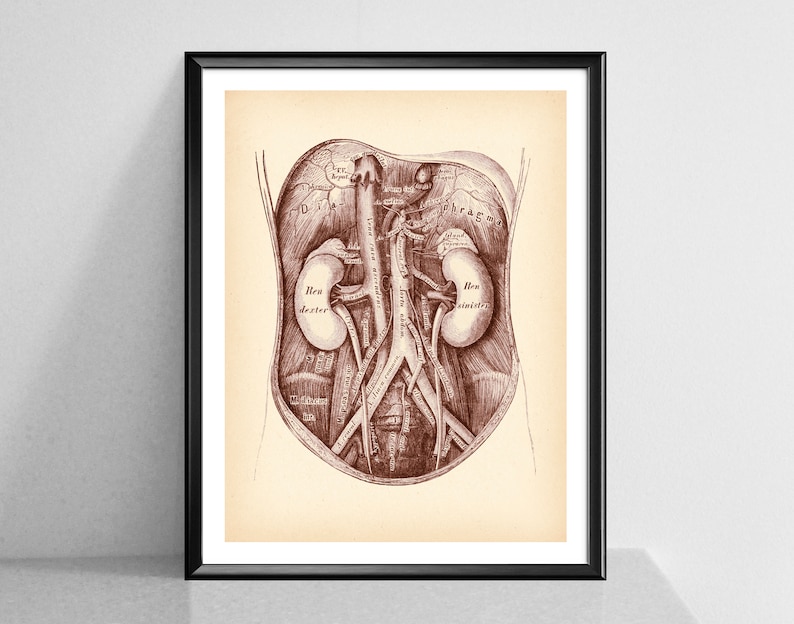
I want to click on 1 white wall, so click(x=685, y=278).